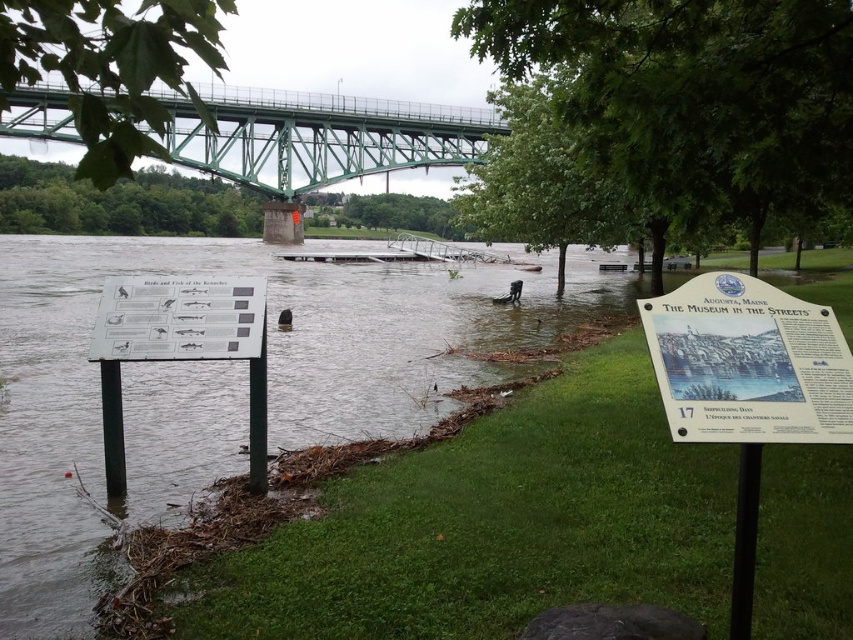
This screenshot has width=853, height=640. What do you see at coordinates (747, 364) in the screenshot? I see `white paper sign at lower right` at bounding box center [747, 364].

Where is `white paper sign at lower right`? white paper sign at lower right is located at coordinates (747, 364).